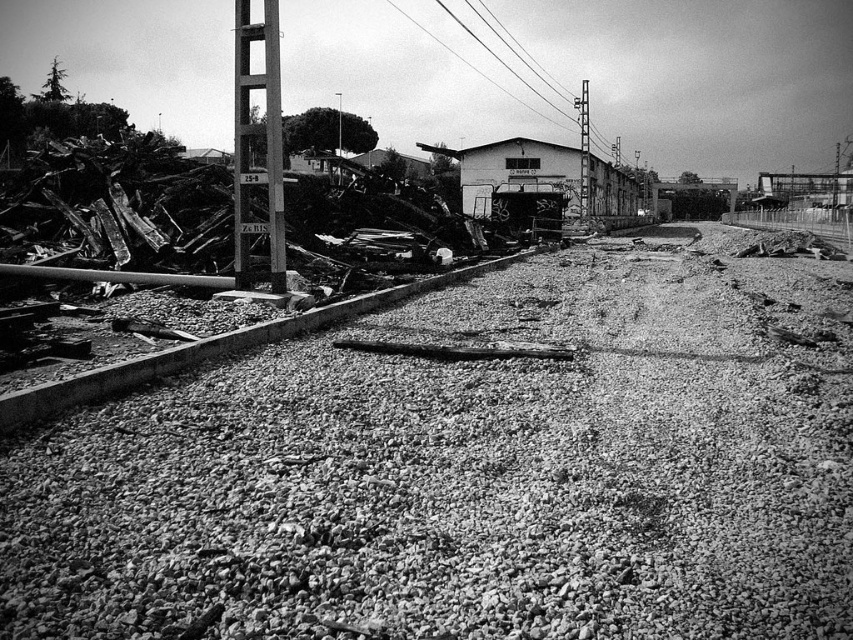
Question: Among these points, which one is farthest from the camera?

Choices:
 (A) [x=244, y=230]
 (B) [x=581, y=93]

Answer: (B)

Question: Is the position of gravelly dirt track at center less distant than that of smooth metal telegraph pole at center?

Choices:
 (A) yes
 (B) no

Answer: (A)

Question: Does gravelly dirt track at center appear under smooth metal telegraph pole at center?

Choices:
 (A) no
 (B) yes

Answer: (B)

Question: Among these points, which one is nearest to the camera?

Choices:
 (A) (664, 588)
 (B) (585, 106)
 (C) (279, 90)

Answer: (A)

Question: Can you confirm if gravelly dirt track at center is bigger than metallic gray pole at center-left?

Choices:
 (A) yes
 (B) no

Answer: (B)

Question: Which object is farther from the camera taking this photo?

Choices:
 (A) smooth metal telegraph pole at center
 (B) gravelly dirt track at center
 (C) metallic gray pole at center-left

Answer: (A)